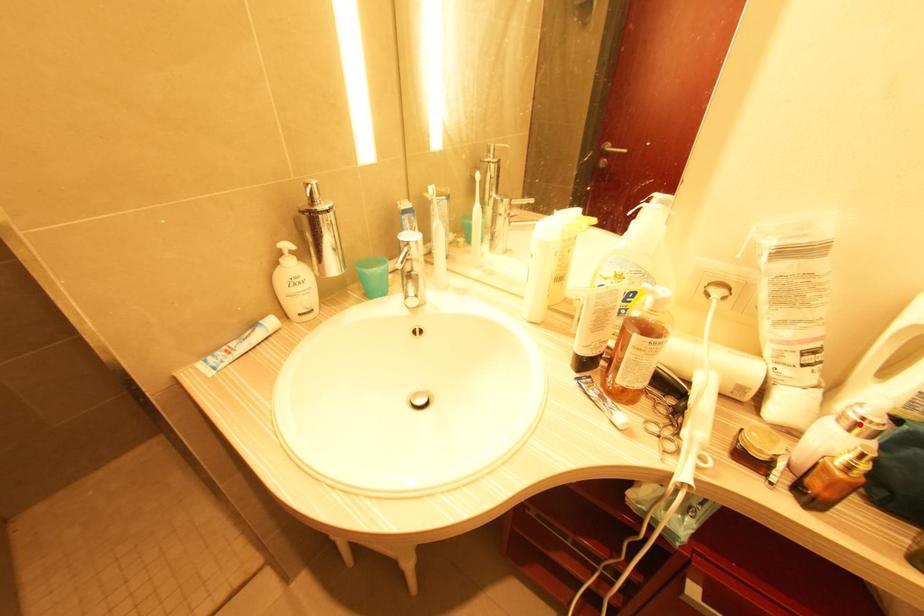
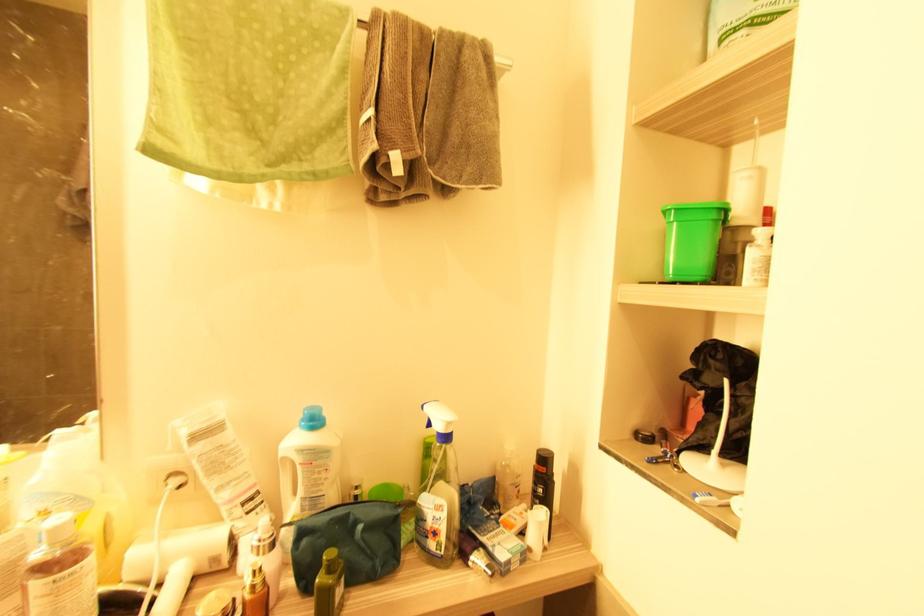
Find the pixel in the second image that matches the highlighted location in the first image.

(261, 546)